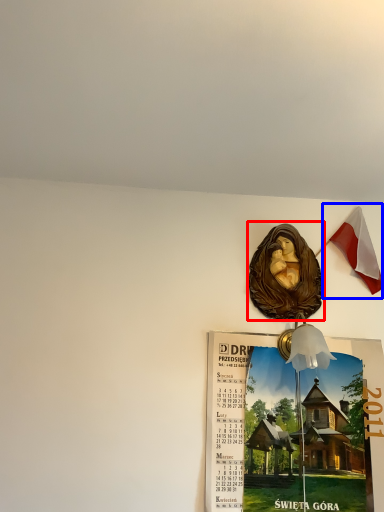
Question: Which object appears farthest to the camera in this image, art (highlighted by a red box) or national flag (highlighted by a blue box)?

Choices:
 (A) art
 (B) national flag

Answer: (B)